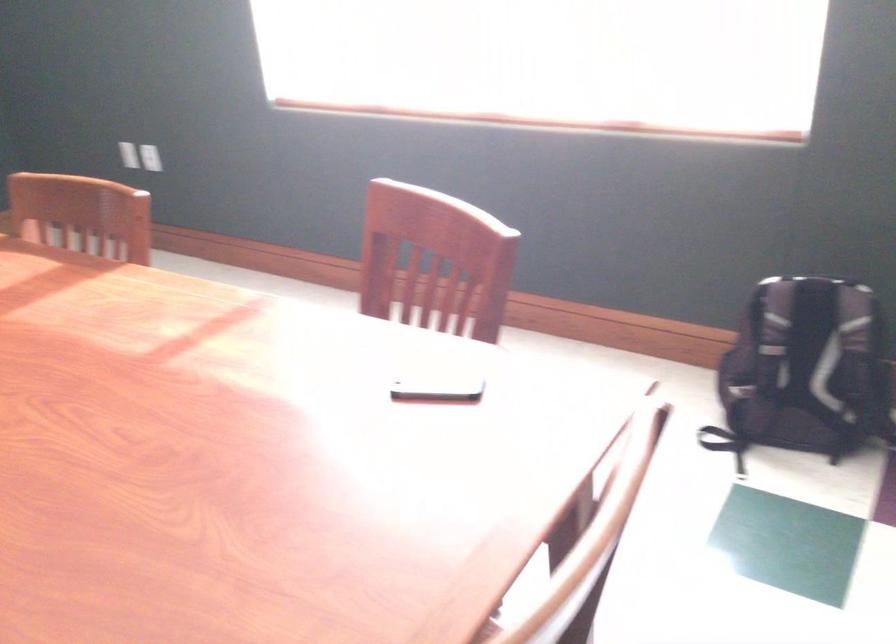
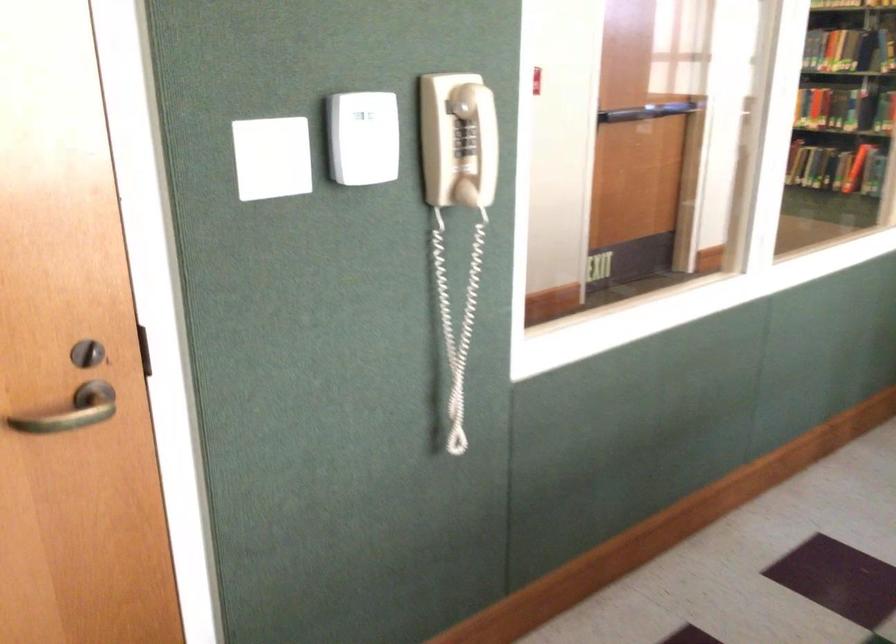
The first image is from the beginning of the video and the second image is from the end. How did the camera likely rotate when shooting the video?

The camera rotated toward left-down.